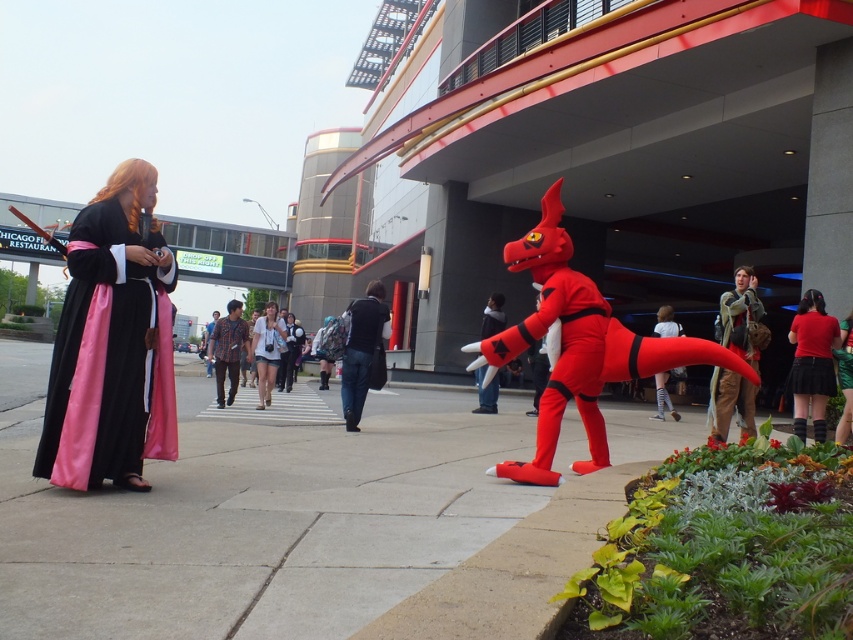
Can you confirm if satin black and pink robe at left is shorter than denim shorts at center?

In fact, satin black and pink robe at left may be taller than denim shorts at center.

Who is positioned more to the left, satin black and pink robe at left or denim shorts at center?

Positioned to the left is denim shorts at center.

The height and width of the screenshot is (640, 853). Identify the location of satin black and pink robe at left. (109, 358).

Does rubberized red dinosaur at center appear over velvet-like red dragon at center?

Actually, rubberized red dinosaur at center is below velvet-like red dragon at center.

From the picture: Between rubberized red dinosaur at center and velvet-like red dragon at center, which one appears on the left side from the viewer's perspective?

Positioned to the left is velvet-like red dragon at center.

Who is more distant from viewer, [544,208] or [492,300]?

Positioned behind is point [492,300].

Locate an element on the screen. The height and width of the screenshot is (640, 853). rubberized red dinosaur at center is located at coordinates (578, 346).

Can you confirm if matte red skirt at lower right is positioned to the right of velvet-like red dragon at center?

Yes, matte red skirt at lower right is to the right of velvet-like red dragon at center.

Measure the distance between matte red skirt at lower right and velvet-like red dragon at center.

A distance of 4.51 meters exists between matte red skirt at lower right and velvet-like red dragon at center.

The width and height of the screenshot is (853, 640). Describe the element at coordinates (811, 364) in the screenshot. I see `matte red skirt at lower right` at that location.

In order to click on matte red skirt at lower right in this screenshot , I will do `click(811, 364)`.